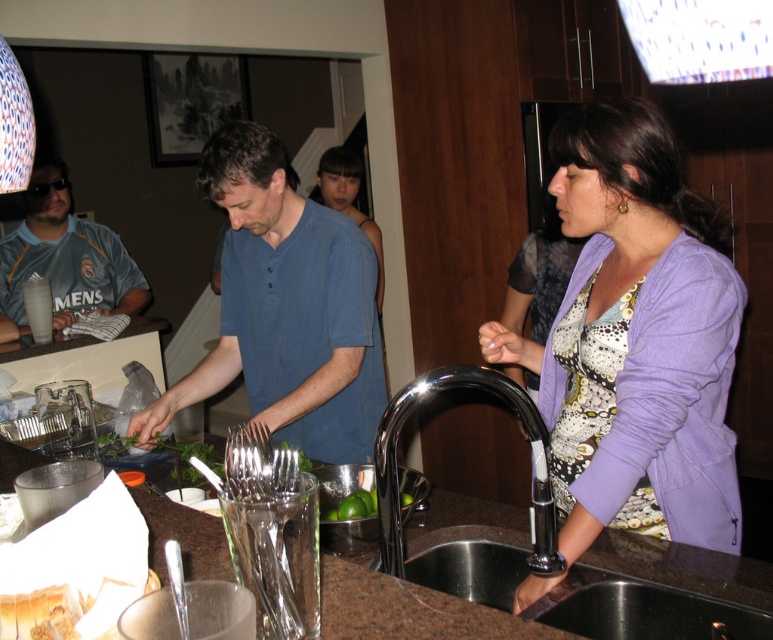
You are a guest at the party and want to place your coat on the purple cotton sweater at lower right without disturbing the metallic sink at lower center. Is there enough space between them?

The purple cotton sweater at lower right is positioned on the right side of the metallic sink at lower center, so there is space between them to place your coat without disturbing the sink.

You are standing in the kitchen and want to place a small plant between the two points, point (363, 554) and point (502, 609). Which point should the plant be closer to so it appears larger in the photo?

The plant should be placed closer to point (363, 554) because it is closer to the camera than point (502, 609), making it appear larger in the photo.